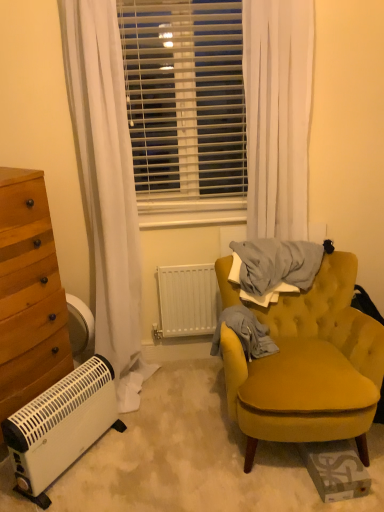
This screenshot has width=384, height=512. Find the location of `empty space that is to the right of white plastic heater at lower left`. empty space that is to the right of white plastic heater at lower left is located at coordinates (143, 464).